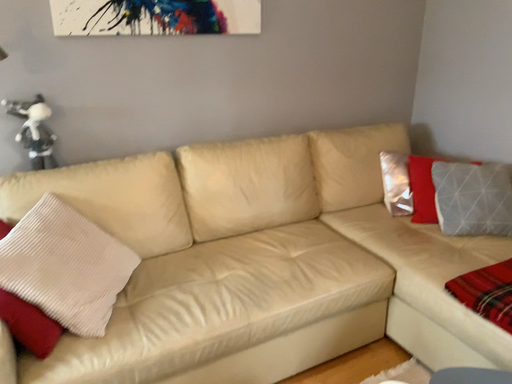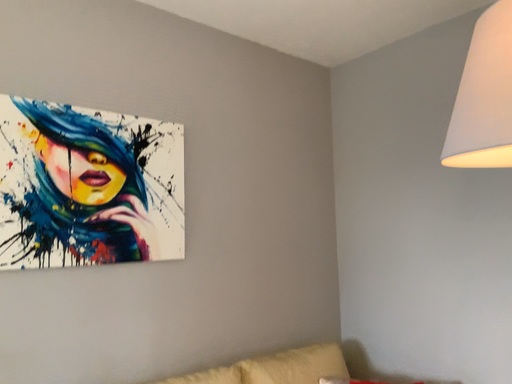
Question: Which way did the camera rotate in the video?

Choices:
 (A) rotated downward
 (B) rotated upward

Answer: (B)